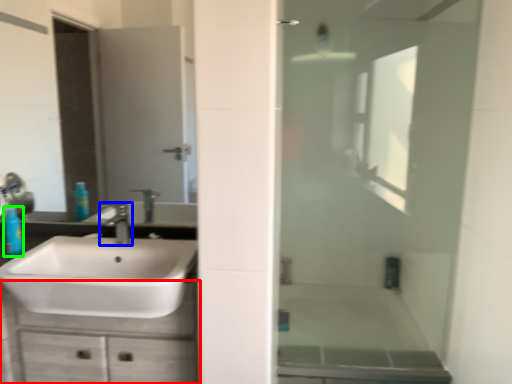
Question: Considering the real-world distances, which object is closest to bathroom cabinet (highlighted by a red box)? tap (highlighted by a blue box) or toiletry (highlighted by a green box).

Choices:
 (A) tap
 (B) toiletry

Answer: (A)